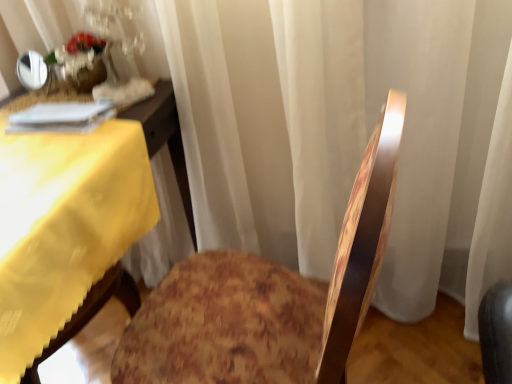
Question: Is yellow fabric table at left smaller than translucent glass vase at upper left?

Choices:
 (A) yes
 (B) no

Answer: (B)

Question: Is translucent glass vase at upper left completely or partially inside yellow fabric table at left?

Choices:
 (A) no
 (B) yes

Answer: (A)

Question: Is yellow fabric table at left beside translucent glass vase at upper left?

Choices:
 (A) yes
 (B) no

Answer: (B)

Question: Is yellow fabric table at left taller than translucent glass vase at upper left?

Choices:
 (A) yes
 (B) no

Answer: (A)

Question: Is yellow fabric table at left at the right side of translucent glass vase at upper left?

Choices:
 (A) no
 (B) yes

Answer: (A)

Question: Is wooden floral-patterned chair at center in front of or behind translucent glass vase at upper left in the image?

Choices:
 (A) front
 (B) behind

Answer: (A)

Question: Do you think wooden floral-patterned chair at center is within translucent glass vase at upper left, or outside of it?

Choices:
 (A) inside
 (B) outside

Answer: (B)

Question: From the image's perspective, is wooden floral-patterned chair at center located above or below translucent glass vase at upper left?

Choices:
 (A) above
 (B) below

Answer: (B)

Question: In terms of height, does wooden floral-patterned chair at center look taller or shorter compared to translucent glass vase at upper left?

Choices:
 (A) tall
 (B) short

Answer: (A)

Question: Is translucent glass vase at upper left bigger or smaller than wooden floral-patterned chair at center?

Choices:
 (A) big
 (B) small

Answer: (B)

Question: Looking at their shapes, would you say translucent glass vase at upper left is wider or thinner than wooden floral-patterned chair at center?

Choices:
 (A) wide
 (B) thin

Answer: (B)

Question: Considering the positions of translucent glass vase at upper left and wooden floral-patterned chair at center in the image, is translucent glass vase at upper left taller or shorter than wooden floral-patterned chair at center?

Choices:
 (A) tall
 (B) short

Answer: (B)

Question: Is point (86, 79) closer or farther from the camera than point (242, 312)?

Choices:
 (A) closer
 (B) farther

Answer: (B)

Question: Visually, is yellow fabric table at left positioned to the left or to the right of wooden floral-patterned chair at center?

Choices:
 (A) left
 (B) right

Answer: (A)

Question: Is yellow fabric table at left in front of or behind wooden floral-patterned chair at center in the image?

Choices:
 (A) behind
 (B) front

Answer: (A)